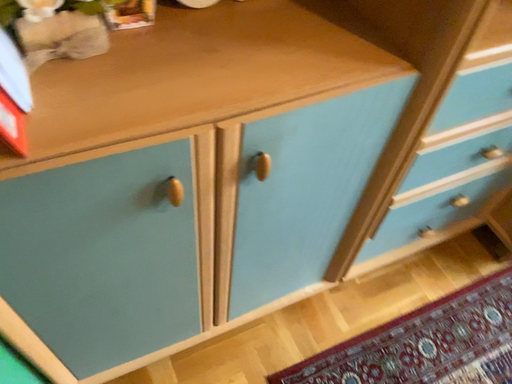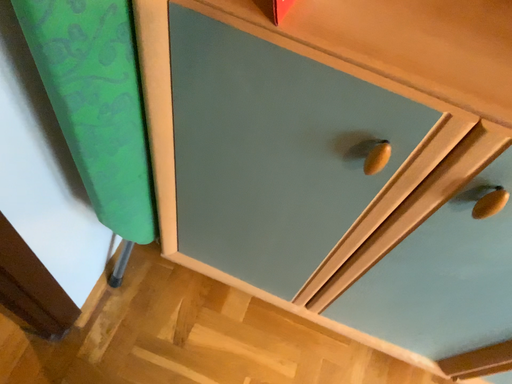
Question: How did the camera likely rotate when shooting the video?

Choices:
 (A) rotated right
 (B) rotated left

Answer: (B)